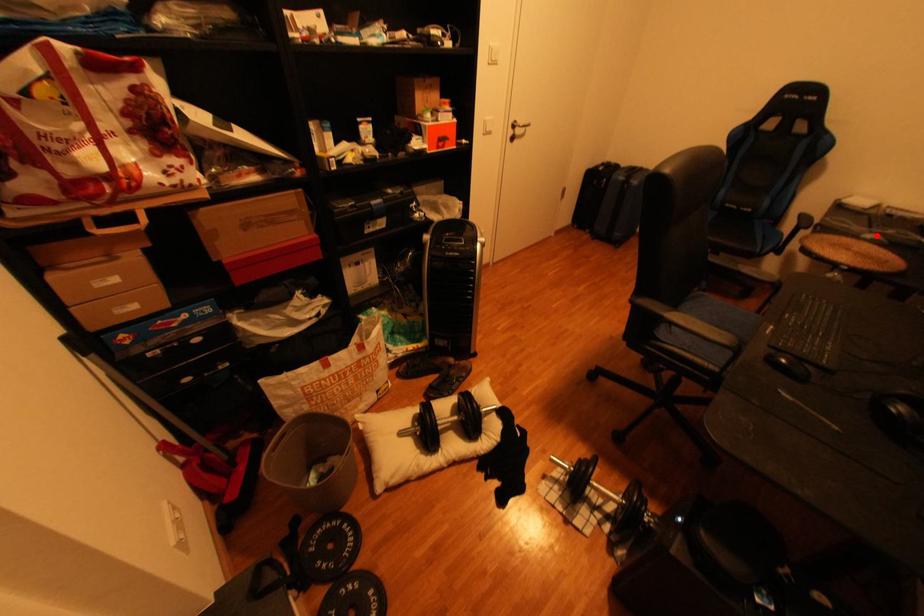
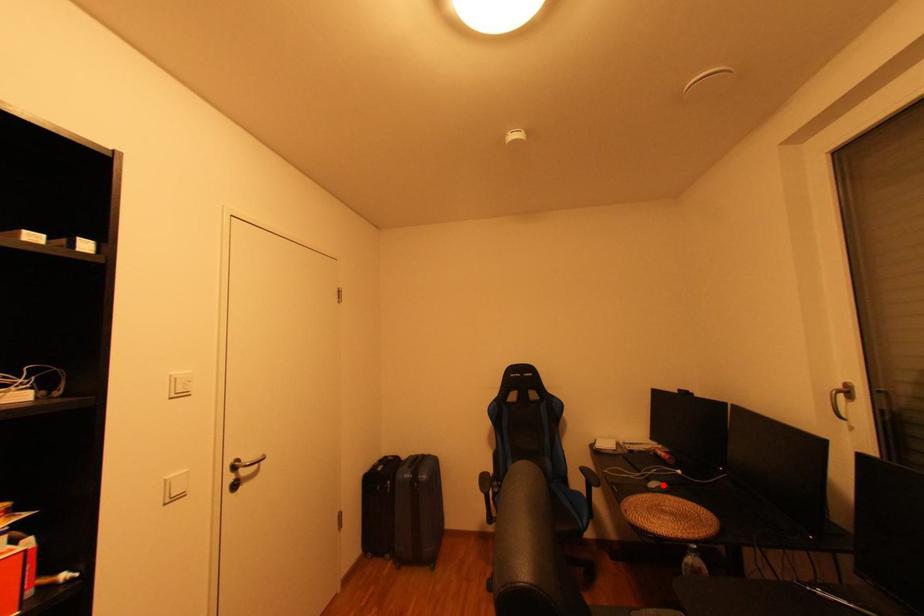
I am providing you with two images of the same scene from different viewpoints. A red point is marked on the first image and another point is marked on the second image. Do the highlighted points in image1 and image2 indicate the same real-world spot?

Yes